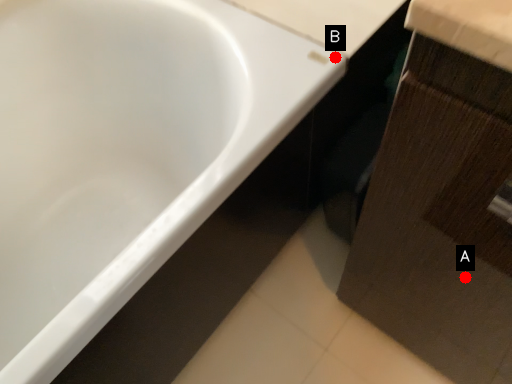
Question: Two points are circled on the image, labeled by A and B beside each circle. Which of the following is the closest to the observer?

Choices:
 (A) A is closer
 (B) B is closer

Answer: (A)